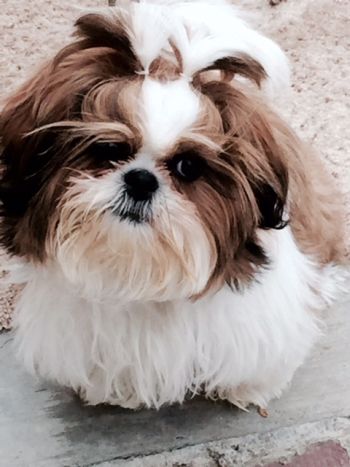
At what (x,y) coordinates should I click in order to perform the action: click on beige carpet. Please return your answer as a coordinate pair (x, y). This screenshot has width=350, height=467. Looking at the image, I should click on (326, 117).